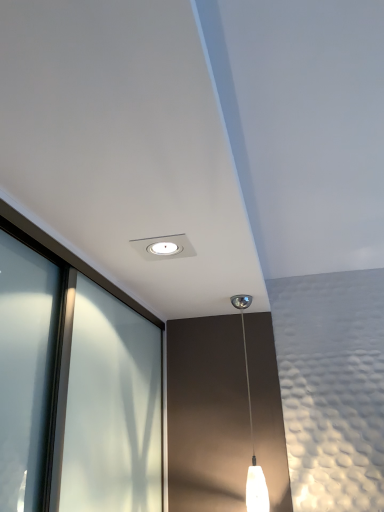
You are a GUI agent. You are given a task and a screenshot of the screen. Output one action in this format:
    pyautogui.click(x=<x>, y=<y>)
    Task: Click on the white glass pendant light at center
    
    Given the screenshot: What is the action you would take?
    pyautogui.click(x=252, y=434)

The image size is (384, 512). What do you see at coordinates (252, 434) in the screenshot?
I see `white glass pendant light at center` at bounding box center [252, 434].

The height and width of the screenshot is (512, 384). Find the location of `white glass pendant light at center`. white glass pendant light at center is located at coordinates (252, 434).